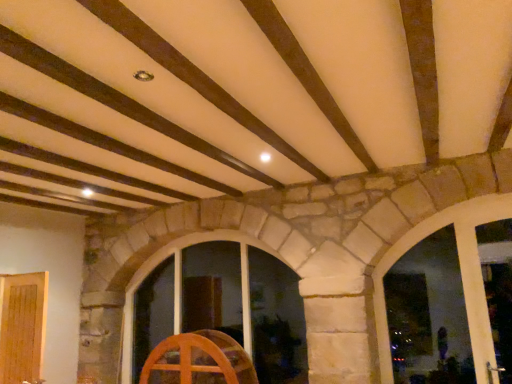
Measure the distance between wooden window at center, the 1th window positioned from the back, and camera.

The distance of wooden window at center, the 1th window positioned from the back, from camera is 4.70 meters.

Locate an element on the screen. This screenshot has height=384, width=512. wooden window at center, the 1th window positioned from the back is located at coordinates (221, 307).

The height and width of the screenshot is (384, 512). In order to click on light brown wood door at lower left in this screenshot , I will do `click(22, 326)`.

From a real-world perspective, which window is the 2nd one above the wooden wheel at center? Please provide its 2D coordinates.

[(422, 239)]

From a real-world perspective, is wooden wheel at center physically located above or below transparent glass window at center, which is counted as the second window, starting from the left?

In terms of real-world spatial position, wooden wheel at center is below transparent glass window at center, which is counted as the second window, starting from the left.

Which is in front, wooden wheel at center or transparent glass window at center, which is counted as the second window, starting from the left?

transparent glass window at center, which is counted as the second window, starting from the left.

Is point (177, 337) in front of point (429, 226)?

No, (177, 337) is behind (429, 226).

Is wooden wheel at center oriented away from light brown wood door at lower left?

wooden wheel at center does not have its back to light brown wood door at lower left.

Is wooden wheel at center wider or thinner than light brown wood door at lower left?

wooden wheel at center is wider than light brown wood door at lower left.

Does point (160, 351) come farther from viewer compared to point (9, 355)?

That is True.

Is wooden wheel at center at the left side of light brown wood door at lower left?

In fact, wooden wheel at center is to the right of light brown wood door at lower left.

Looking at this image, is transparent glass window at center, which is the 1th window from right to left, facing towards wooden wheel at center?

No, transparent glass window at center, which is the 1th window from right to left, is not oriented towards wooden wheel at center.

From a real-world perspective, is transparent glass window at center, which is the 1th window from right to left, below wooden wheel at center?

No, from a real-world perspective, transparent glass window at center, which is the 1th window from right to left, is not beneath wooden wheel at center.

Considering the relative positions of transparent glass window at center, which is the 1th window from right to left, and wooden wheel at center in the image provided, is transparent glass window at center, which is the 1th window from right to left, to the left or to the right of wooden wheel at center?

Based on their positions, transparent glass window at center, which is the 1th window from right to left, is located to the right of wooden wheel at center.

You are a GUI agent. You are given a task and a screenshot of the screen. Output one action in this format:
    pyautogui.click(x=<x>, y=<y>)
    Task: Click on the window that is the 2nd object above the wooden wheel at center (from a real-world perspective)
    The height and width of the screenshot is (384, 512).
    Given the screenshot: What is the action you would take?
    pyautogui.click(x=422, y=239)

From a real-world perspective, is wooden window at center, the 1th window positioned from the back, on top of transparent glass window at center, marked as the 2th window in a back-to-front arrangement?

No, from a real-world perspective, wooden window at center, the 1th window positioned from the back, is not over transparent glass window at center, marked as the 2th window in a back-to-front arrangement

Considering the relative sizes of wooden window at center, which is counted as the second window, starting from the right, and transparent glass window at center, which is counted as the 1th window, starting from the front, in the image provided, is wooden window at center, which is counted as the second window, starting from the right, wider than transparent glass window at center, which is counted as the 1th window, starting from the front,?

Yes, wooden window at center, which is counted as the second window, starting from the right, is wider than transparent glass window at center, which is counted as the 1th window, starting from the front.

Does wooden window at center, the 1th window positioned from the back, turn towards transparent glass window at center, which is counted as the second window, starting from the left?

No, wooden window at center, the 1th window positioned from the back, is not facing towards transparent glass window at center, which is counted as the second window, starting from the left.

Is wooden window at center, which is the first window from left to right, spatially inside transparent glass window at center, which is counted as the 1th window, starting from the front, or outside of it?

wooden window at center, which is the first window from left to right, cannot be found inside transparent glass window at center, which is counted as the 1th window, starting from the front.

Is wooden window at center, acting as the second window starting from the front, surrounded by transparent glass window at center, which is counted as the 1th window, starting from the front?

No.

How distant is transparent glass window at center, which is counted as the second window, starting from the left, from wooden window at center, acting as the second window starting from the front?

They are 2.26 meters apart.

Who is smaller, transparent glass window at center, which is the 1th window from right to left, or wooden window at center, which is the first window from left to right?

With smaller size is transparent glass window at center, which is the 1th window from right to left.

Where is `window located on the left of transparent glass window at center, which is the 1th window from right to left`? window located on the left of transparent glass window at center, which is the 1th window from right to left is located at coordinates (221, 307).

From a real-world perspective, is transparent glass window at center, which is counted as the 1th window, starting from the front, above or below light brown wood door at lower left?

In terms of real-world spatial position, transparent glass window at center, which is counted as the 1th window, starting from the front, is above light brown wood door at lower left.

Considering the relative positions of transparent glass window at center, which is counted as the 1th window, starting from the front, and light brown wood door at lower left in the image provided, is transparent glass window at center, which is counted as the 1th window, starting from the front, to the left or to the right of light brown wood door at lower left?

Based on their positions, transparent glass window at center, which is counted as the 1th window, starting from the front, is located to the right of light brown wood door at lower left.

From the image's perspective, is transparent glass window at center, which is counted as the second window, starting from the left, above or below light brown wood door at lower left?

Based on their image positions, transparent glass window at center, which is counted as the second window, starting from the left, is located above light brown wood door at lower left.

Which is nearer, (160, 329) or (14, 383)?

Point (160, 329) is farther from the camera than point (14, 383).

Is wooden window at center, which is counted as the second window, starting from the right, not close to light brown wood door at lower left?

Yes, wooden window at center, which is counted as the second window, starting from the right, is far from light brown wood door at lower left.

From the picture: From a real-world perspective, is wooden window at center, which is counted as the second window, starting from the right, located higher than light brown wood door at lower left?

Correct, in the physical world, wooden window at center, which is counted as the second window, starting from the right, is higher than light brown wood door at lower left.

Is wooden window at center, which is the first window from left to right, outside of light brown wood door at lower left?

wooden window at center, which is the first window from left to right, is positioned outside light brown wood door at lower left.

The image size is (512, 384). I want to click on window that is the 2nd one when counting upward from the wooden wheel at center (from the image's perspective), so click(422, 239).

Where is `furniture that is on the right side of light brown wood door at lower left`? This screenshot has height=384, width=512. furniture that is on the right side of light brown wood door at lower left is located at coordinates tap(199, 360).

Based on their spatial positions, is transparent glass window at center, which is counted as the second window, starting from the left, or light brown wood door at lower left closer to wooden window at center, acting as the second window starting from the front?

light brown wood door at lower left.

Looking at this image, from the image, which object appears to be farther from light brown wood door at lower left, transparent glass window at center, which is counted as the 1th window, starting from the front, or wooden window at center, which is counted as the second window, starting from the right?

transparent glass window at center, which is counted as the 1th window, starting from the front.

Estimate the real-world distances between objects in this image. Which object is closer to wooden wheel at center, transparent glass window at center, which is the 1th window from right to left, or light brown wood door at lower left?

The object closer to wooden wheel at center is light brown wood door at lower left.

Which object lies further to the anchor point wooden wheel at center, wooden window at center, the 1th window positioned from the back, or light brown wood door at lower left?

light brown wood door at lower left is positioned further to the anchor wooden wheel at center.

Based on their spatial positions, is light brown wood door at lower left or wooden window at center, which is counted as the second window, starting from the right, further from wooden wheel at center?

light brown wood door at lower left lies further to wooden wheel at center than the other object.

From the image, which object appears to be farther from wooden window at center, the 1th window positioned from the back, light brown wood door at lower left or wooden wheel at center?

light brown wood door at lower left is positioned further to the anchor wooden window at center, the 1th window positioned from the back.

From the image, which object appears to be farther from light brown wood door at lower left, transparent glass window at center, which is counted as the 1th window, starting from the front, or wooden wheel at center?

Based on the image, transparent glass window at center, which is counted as the 1th window, starting from the front, appears to be further to light brown wood door at lower left.

Considering their positions, is wooden window at center, which is the first window from left to right, positioned closer to light brown wood door at lower left than transparent glass window at center, marked as the 2th window in a back-to-front arrangement?

Based on the image, wooden window at center, which is the first window from left to right, appears to be nearer to light brown wood door at lower left.

Where is `window situated between wooden wheel at center and transparent glass window at center, which is the 1th window from right to left, from left to right`? The width and height of the screenshot is (512, 384). window situated between wooden wheel at center and transparent glass window at center, which is the 1th window from right to left, from left to right is located at coordinates (221, 307).

The image size is (512, 384). Find the location of `window between light brown wood door at lower left and transparent glass window at center, which is counted as the 1th window, starting from the front, from left to right`. window between light brown wood door at lower left and transparent glass window at center, which is counted as the 1th window, starting from the front, from left to right is located at coordinates (221, 307).

This screenshot has height=384, width=512. In order to click on furniture between light brown wood door at lower left and transparent glass window at center, which is the 1th window from right to left in this screenshot , I will do `click(199, 360)`.

Image resolution: width=512 pixels, height=384 pixels. I want to click on furniture between light brown wood door at lower left and wooden window at center, which is counted as the second window, starting from the right, so click(199, 360).